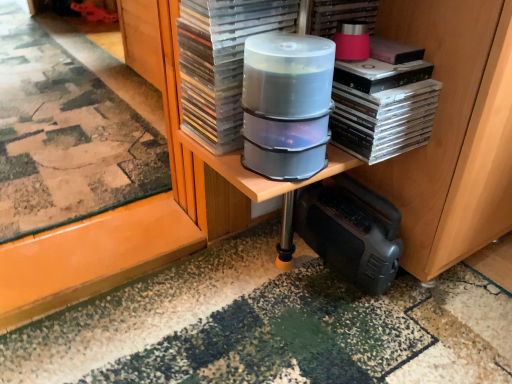
Question: Is clear plastic container at center, placed as the first appliance when sorted from top to bottom, looking in the opposite direction of pink matte paperback book at upper right, the second paperback book when ordered from left to right?

Choices:
 (A) yes
 (B) no

Answer: (B)

Question: From the image's perspective, is clear plastic container at center, marked as the 2th appliance in a back-to-front arrangement, on pink matte paperback book at upper right, the first paperback book when ordered from right to left?

Choices:
 (A) yes
 (B) no

Answer: (B)

Question: Is pink matte paperback book at upper right, the second paperback book when ordered from left to right, a part of clear plastic container at center, positioned as the first appliance in front-to-back order?

Choices:
 (A) yes
 (B) no

Answer: (B)

Question: Is clear plastic container at center, marked as the 2th appliance in a back-to-front arrangement, closer to camera compared to pink matte paperback book at upper right, the first paperback book when ordered from right to left?

Choices:
 (A) no
 (B) yes

Answer: (B)

Question: Considering the relative sizes of clear plastic container at center, positioned as the first appliance in front-to-back order, and pink matte paperback book at upper right, the first paperback book when ordered from right to left, in the image provided, is clear plastic container at center, positioned as the first appliance in front-to-back order, thinner than pink matte paperback book at upper right, the first paperback book when ordered from right to left,?

Choices:
 (A) yes
 (B) no

Answer: (B)

Question: Is clear plastic container at center, arranged as the 2th appliance when ordered from the bottom, oriented towards pink matte paperback book at upper right, the second paperback book when ordered from left to right?

Choices:
 (A) no
 (B) yes

Answer: (A)

Question: Is black plastic speaker at lower right, the 2th appliance from the front, positioned behind clear plastic cd cases at center?

Choices:
 (A) no
 (B) yes

Answer: (B)

Question: From a real-world perspective, is black plastic speaker at lower right, acting as the 1th appliance starting from the back, over clear plastic cd cases at center?

Choices:
 (A) no
 (B) yes

Answer: (A)

Question: Is clear plastic cd cases at center located within black plastic speaker at lower right, placed as the 2th appliance when sorted from top to bottom?

Choices:
 (A) no
 (B) yes

Answer: (A)

Question: Is black plastic speaker at lower right, acting as the 1th appliance starting from the back, outside clear plastic cd cases at center?

Choices:
 (A) yes
 (B) no

Answer: (A)

Question: Considering the relative positions of black plastic speaker at lower right, marked as the 1th appliance in a bottom-to-top arrangement, and clear plastic cd cases at center in the image provided, is black plastic speaker at lower right, marked as the 1th appliance in a bottom-to-top arrangement, in front of clear plastic cd cases at center?

Choices:
 (A) yes
 (B) no

Answer: (B)

Question: From the image's perspective, is black plastic speaker at lower right, marked as the 1th appliance in a bottom-to-top arrangement, below clear plastic cd cases at center?

Choices:
 (A) no
 (B) yes

Answer: (B)

Question: Is there a large distance between transparent plastic case at center, marked as the second paperback book in a right-to-left arrangement, and clear plastic cd cases at center?

Choices:
 (A) yes
 (B) no

Answer: (B)